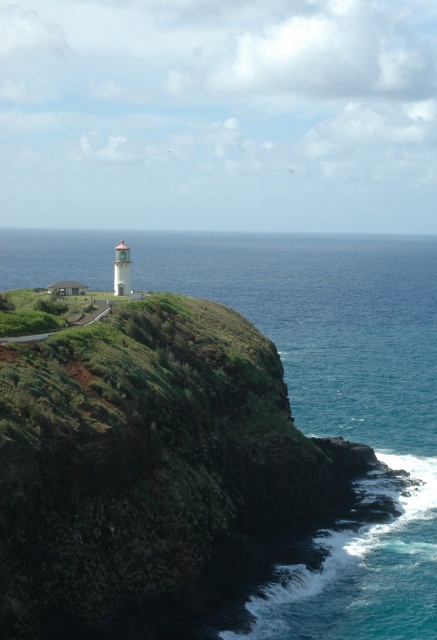
Is blue water at lower right positioned before green grassy shoreline at lower left?

Yes, blue water at lower right is closer to the viewer.

Does point (312, 289) come behind point (110, 304)?

That is True.

Is point (374, 573) positioned after point (104, 308)?

No, (374, 573) is in front of (104, 308).

Where is `blue water at lower right`? This screenshot has width=437, height=640. blue water at lower right is located at coordinates (312, 387).